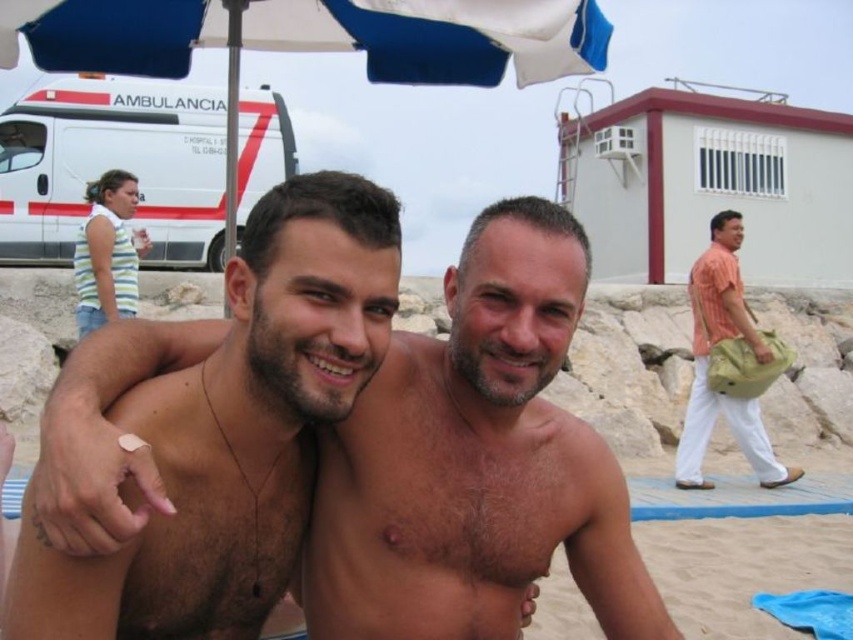
Question: Which point appears farthest from the camera in this image?

Choices:
 (A) (93, 84)
 (B) (755, 422)

Answer: (A)

Question: Which object is the farthest from the orange cotton shirt at right?

Choices:
 (A) brown hair at center
 (B) white glossy ambulance at upper left
 (C) blue fabric umbrella at upper center

Answer: (B)

Question: Can you confirm if blue fabric umbrella at upper center is bigger than white glossy ambulance at upper left?

Choices:
 (A) yes
 (B) no

Answer: (B)

Question: Which point is closer to the camera taking this photo?

Choices:
 (A) (706, 273)
 (B) (334, 624)
 (C) (552, 13)

Answer: (B)

Question: Does brown hair at center have a smaller size compared to blue fabric umbrella at upper center?

Choices:
 (A) no
 (B) yes

Answer: (B)

Question: Is blue fabric umbrella at upper center below orange cotton shirt at right?

Choices:
 (A) yes
 (B) no

Answer: (B)